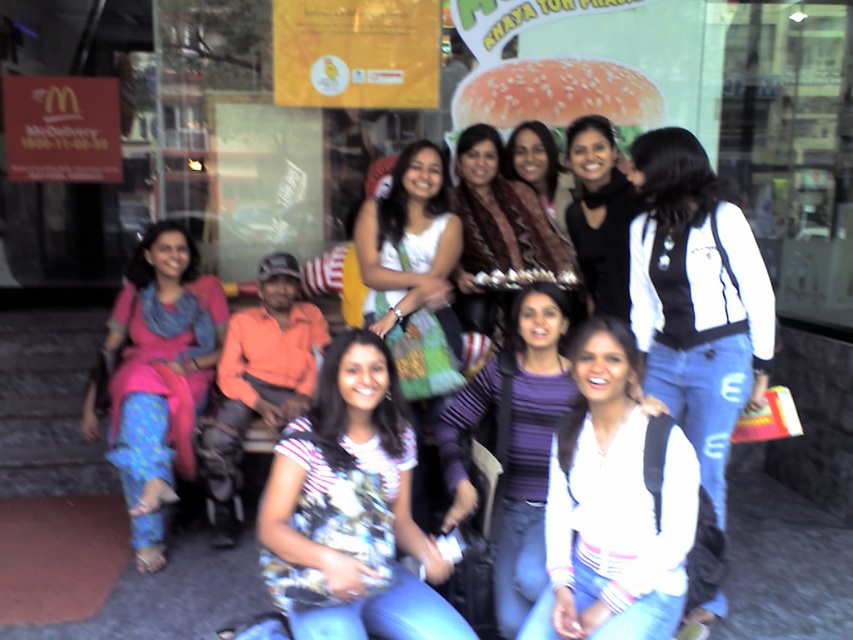
Question: Which object appears closest to the camera in this image?

Choices:
 (A) white matte backpack at center
 (B) striped fabric scarf at upper center
 (C) striped shirt at center

Answer: (A)

Question: Estimate the real-world distances between objects in this image. Which object is closer to the black matte jacket at upper center?

Choices:
 (A) matte pink dress at left
 (B) striped fabric scarf at upper center
 (C) striped cotton shirt at center
 (D) striped shirt at center

Answer: (D)

Question: Which object is farther from the camera taking this photo?

Choices:
 (A) white fabric bag at center
 (B) white matte backpack at center
 (C) matte pink dress at left
 (D) striped shirt at center

Answer: (D)

Question: Can you confirm if white fabric bag at center is bigger than striped fabric scarf at upper center?

Choices:
 (A) no
 (B) yes

Answer: (B)

Question: Is the position of matte pink dress at left less distant than that of striped fabric scarf at upper center?

Choices:
 (A) no
 (B) yes

Answer: (B)

Question: Can you confirm if striped cotton shirt at center is positioned to the right of white fabric bag at center?

Choices:
 (A) yes
 (B) no

Answer: (B)